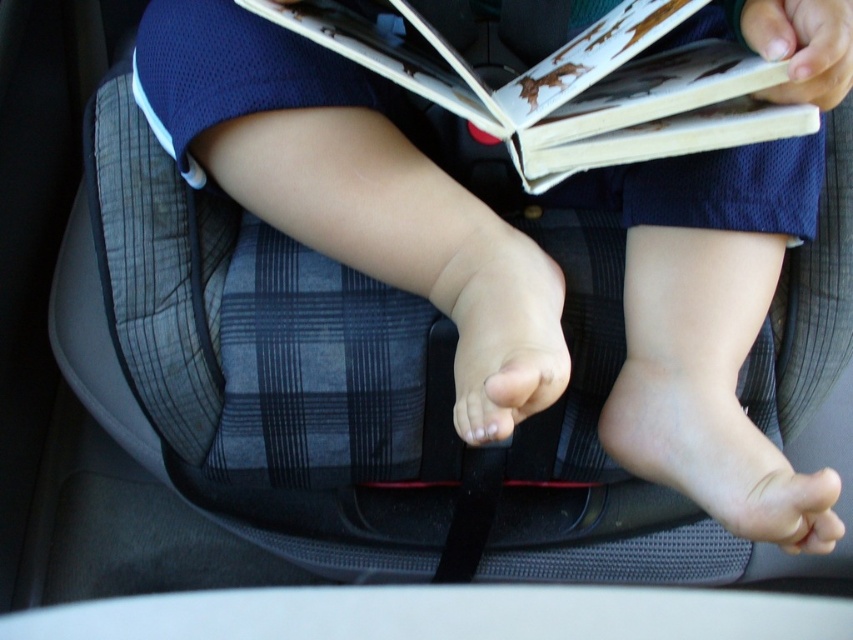
Is point (780, 525) closer to camera compared to point (440, 266)?

Yes, it is.

Is pale skin foot at center further to camera compared to pink flesh-toned foot at center?

Yes, pale skin foot at center is further from the viewer.

Which is behind, point (683, 484) or point (515, 323)?

The point (683, 484) is behind.

At what (x,y) coordinates should I click in order to perform the action: click on pale skin foot at center. Please return your answer as a coordinate pair (x, y). Looking at the image, I should click on (715, 452).

In the scene shown: Is white paper book at upper center further to camera compared to pale skin foot at center?

No, it is not.

Is white paper book at upper center taller than pale skin foot at center?

Correct, white paper book at upper center is much taller as pale skin foot at center.

Which is in front, point (651, 113) or point (669, 480)?

Point (651, 113) is in front.

Locate an element on the screen. The image size is (853, 640). white paper book at upper center is located at coordinates (x=575, y=86).

Between white paper book at upper center and pink flesh-toned foot at center, which one appears on the left side from the viewer's perspective?

pink flesh-toned foot at center is more to the left.

Can you confirm if white paper book at upper center is thinner than pink flesh-toned foot at center?

No.

Is point (656, 128) positioned before point (519, 296)?

Yes, it is in front of point (519, 296).

Locate an element on the screen. white paper book at upper center is located at coordinates (575, 86).